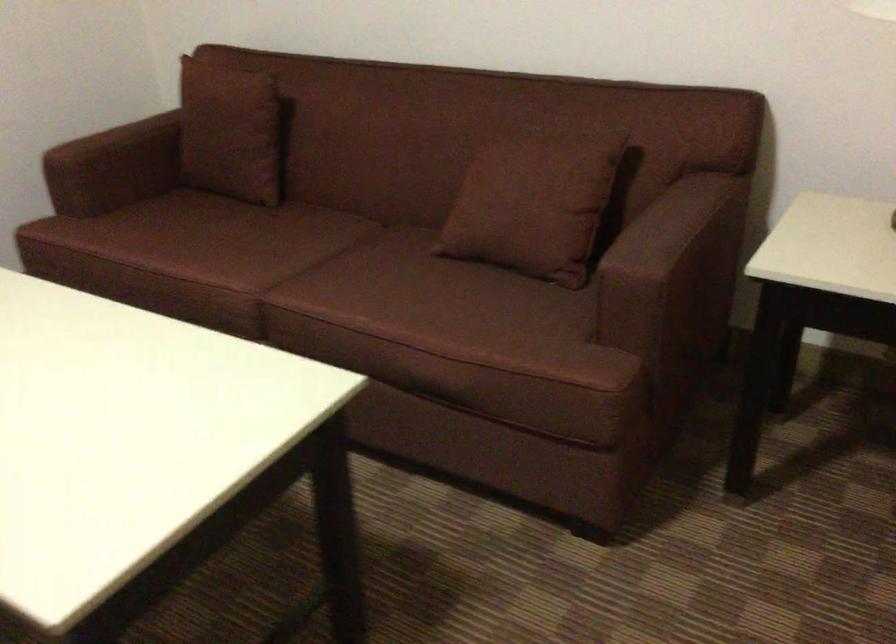
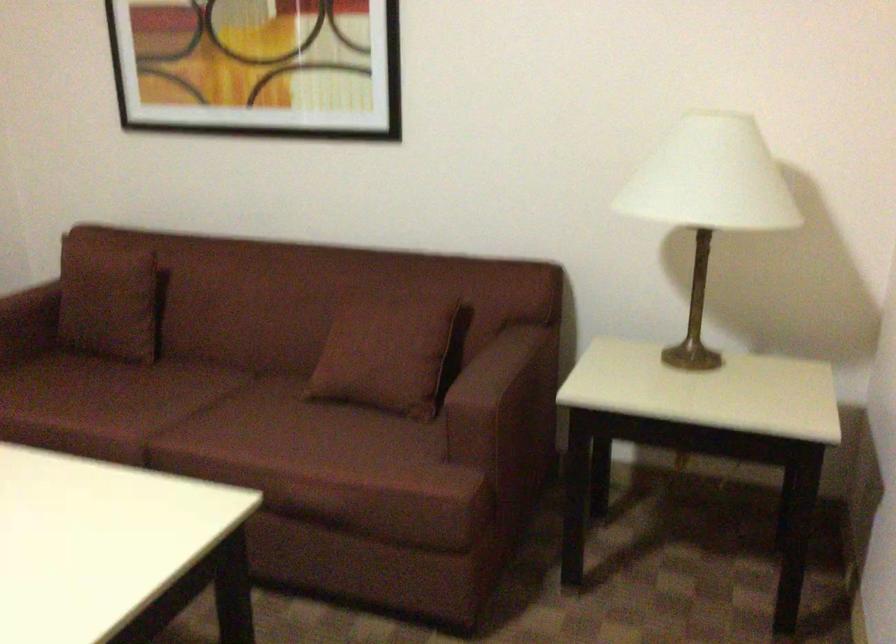
Question: How did the camera likely rotate?

Choices:
 (A) Left
 (B) Right
 (C) Up
 (D) Down

Answer: (B)